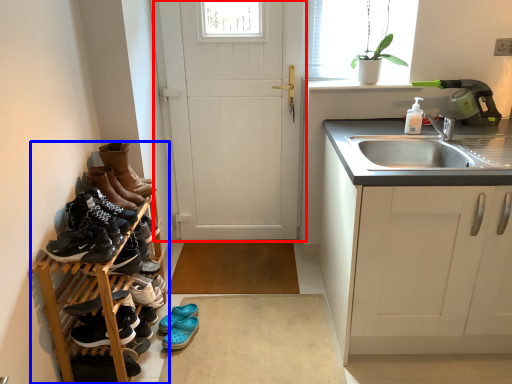
Question: Which of the following is the closest to the observer, door (highlighted by a red box) or carpetry (highlighted by a blue box)?

Choices:
 (A) door
 (B) carpetry

Answer: (B)